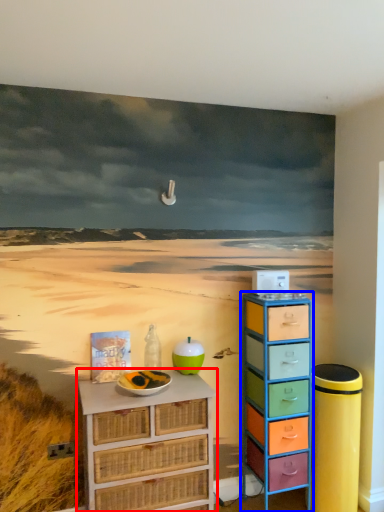
Question: Which object appears farthest to the camera in this image, chest of drawers (highlighted by a red box) or chest of drawers (highlighted by a blue box)?

Choices:
 (A) chest of drawers
 (B) chest of drawers

Answer: (B)